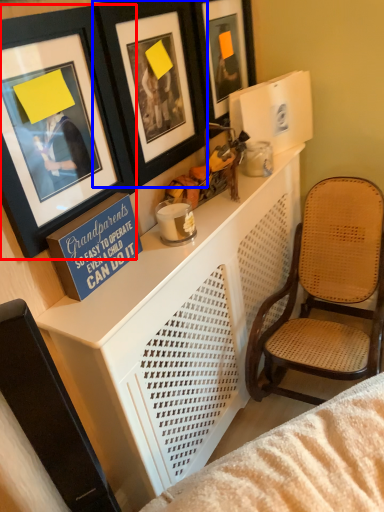
Question: Which of the following is the farthest to the observer, picture frame (highlighted by a red box) or picture frame (highlighted by a blue box)?

Choices:
 (A) picture frame
 (B) picture frame

Answer: (B)